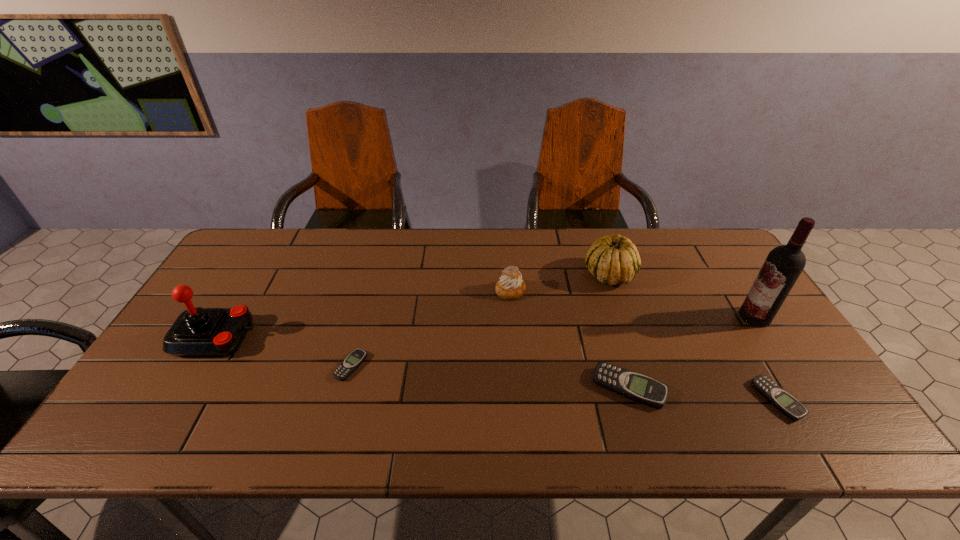
Identify the location of vacant area between the shortest beeper and the pastry. This screenshot has height=540, width=960. (431, 328).

Locate an element on the screen. This screenshot has width=960, height=540. vacant area that lies between the fifth tallest object and the wine bottle is located at coordinates (692, 352).

Select which object is the third closest to the shortest beeper. Please provide its 2D coordinates. Your answer should be formatted as a tuple, i.e. [(x, y)], where the tuple contains the x and y coordinates of a point satisfying the conditions above.

[(637, 387)]

At what (x,y) coordinates should I click in order to perform the action: click on the fourth closest object relative to the third tallest object. Please return your answer as a coordinate pair (x, y). This screenshot has width=960, height=540. Looking at the image, I should click on (778, 397).

Identify which beeper is the nearest to the third shortest object. Please provide its 2D coordinates. Your answer should be formatted as a tuple, i.e. [(x, y)], where the tuple contains the x and y coordinates of a point satisfying the conditions above.

[(778, 397)]

Image resolution: width=960 pixels, height=540 pixels. I want to click on the second closest beeper to the third shortest object, so click(355, 358).

Find the location of a particular element. This screenshot has height=540, width=960. free location that satisfies the following two spatial constraints: 1. on the base of the third shortest object; 2. on the right side of the leftmost object is located at coordinates (186, 388).

Locate an element on the screen. This screenshot has height=540, width=960. free space that satisfies the following two spatial constraints: 1. on the front side of the rightmost beeper; 2. on the right side of the fourth shortest object is located at coordinates (518, 400).

This screenshot has width=960, height=540. Identify the location of vacant space that satisfies the following two spatial constraints: 1. on the front side of the fourth shortest object; 2. on the left side of the second shortest beeper. (518, 400).

This screenshot has height=540, width=960. I want to click on vacant point that satisfies the following two spatial constraints: 1. on the back side of the sixth object from right to left; 2. on the base of the joystick, so pos(359,337).